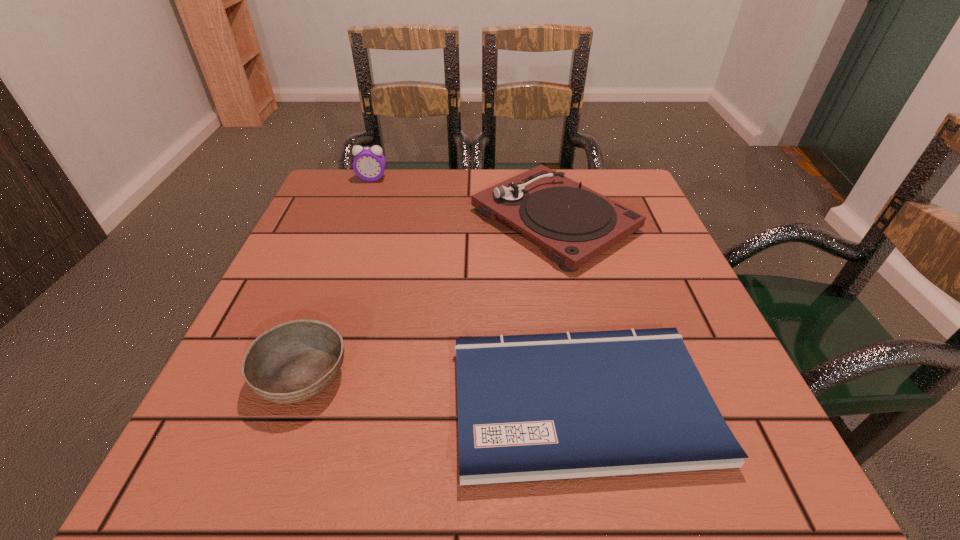
Identify the location of vacant area between the second shortest object and the tallest object. The image size is (960, 540). (338, 277).

Find the location of a particular element. The height and width of the screenshot is (540, 960). vacant space that's between the tallest object and the third tallest object is located at coordinates (338, 277).

Locate an element on the screen. empty location between the phonograph_record and the paperback book is located at coordinates (567, 310).

Identify the location of vacant area between the alarm clock and the shortest object. (476, 289).

Find the location of a particular element. The image size is (960, 540). object that is the second closest to the second tallest object is located at coordinates (369, 164).

This screenshot has height=540, width=960. Find the location of `object that stands as the second closest to the paperback book`. object that stands as the second closest to the paperback book is located at coordinates (294, 361).

Image resolution: width=960 pixels, height=540 pixels. I want to click on free point that satisfies the following two spatial constraints: 1. on the back side of the phonograph_record; 2. on the right side of the paperback book, so [545, 220].

Locate an element on the screen. vacant region that satisfies the following two spatial constraints: 1. on the face of the shortest object; 2. on the right side of the tallest object is located at coordinates (292, 401).

Find the location of `free space that satisfies the following two spatial constraints: 1. on the face of the third tallest object; 2. on the right side of the tallest object`. free space that satisfies the following two spatial constraints: 1. on the face of the third tallest object; 2. on the right side of the tallest object is located at coordinates click(x=300, y=376).